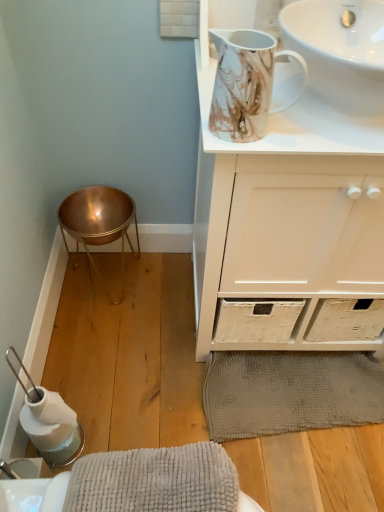
Question: Does white glossy sink at upper right, which appears as the 2th sink when ordered from the bottom, have a lesser height compared to copper/metallic bar stool at lower left?

Choices:
 (A) yes
 (B) no

Answer: (A)

Question: Can you confirm if white glossy sink at upper right, which appears as the 2th sink when ordered from the bottom, is taller than copper/metallic bar stool at lower left?

Choices:
 (A) no
 (B) yes

Answer: (A)

Question: Can you confirm if white glossy sink at upper right, which appears as the 2th sink when ordered from the bottom, is smaller than copper/metallic bar stool at lower left?

Choices:
 (A) no
 (B) yes

Answer: (B)

Question: Is white glossy sink at upper right, which appears as the 2th sink when ordered from the bottom, positioned before copper/metallic bar stool at lower left?

Choices:
 (A) yes
 (B) no

Answer: (A)

Question: From the image's perspective, is white glossy sink at upper right, the first sink positioned from the top, over copper/metallic bar stool at lower left?

Choices:
 (A) no
 (B) yes

Answer: (B)

Question: Is white glossy sink at upper right, which appears as the 2th sink when ordered from the bottom, bigger than copper/metallic bar stool at lower left?

Choices:
 (A) no
 (B) yes

Answer: (A)

Question: Does gray textured bath mat at lower center have a greater width compared to white glossy sink at upper right, placed as the 1th sink when sorted from bottom to top?

Choices:
 (A) yes
 (B) no

Answer: (B)

Question: From the image's perspective, is gray textured bath mat at lower center below white glossy sink at upper right, placed as the second sink when sorted from top to bottom?

Choices:
 (A) yes
 (B) no

Answer: (A)

Question: Is gray textured bath mat at lower center shorter than white glossy sink at upper right, placed as the 1th sink when sorted from bottom to top?

Choices:
 (A) no
 (B) yes

Answer: (B)

Question: Can you confirm if gray textured bath mat at lower center is thinner than white glossy sink at upper right, placed as the second sink when sorted from top to bottom?

Choices:
 (A) yes
 (B) no

Answer: (A)

Question: Can you confirm if gray textured bath mat at lower center is bigger than white glossy sink at upper right, placed as the second sink when sorted from top to bottom?

Choices:
 (A) no
 (B) yes

Answer: (A)

Question: Is gray textured bath mat at lower center placed right next to white glossy sink at upper right, placed as the 1th sink when sorted from bottom to top?

Choices:
 (A) yes
 (B) no

Answer: (B)

Question: Considering the relative sizes of white glossy sink at upper right, placed as the second sink when sorted from top to bottom, and copper/metallic bar stool at lower left in the image provided, is white glossy sink at upper right, placed as the second sink when sorted from top to bottom, taller than copper/metallic bar stool at lower left?

Choices:
 (A) no
 (B) yes

Answer: (A)